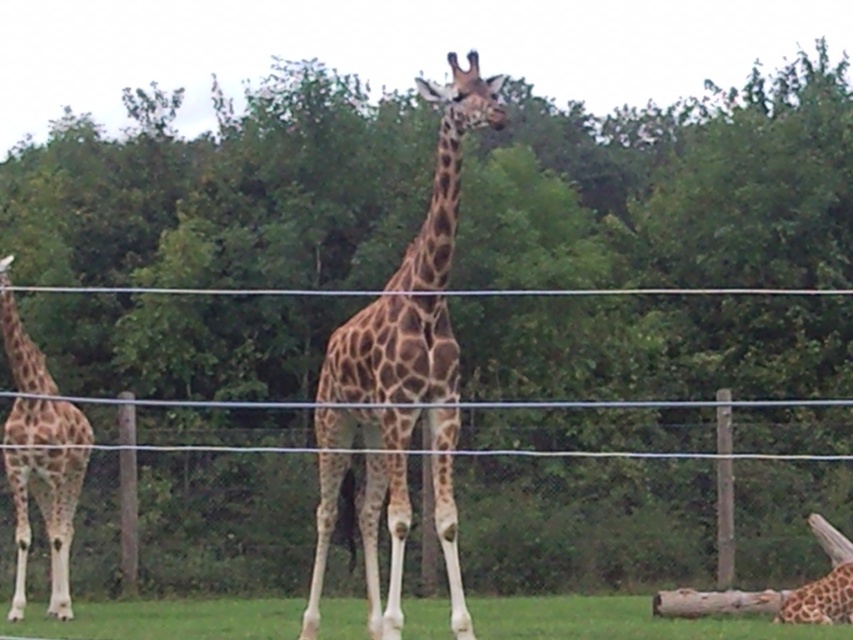
Question: Can you confirm if wire mesh fence at center is positioned above spotted fur giraffe at lower right?

Choices:
 (A) no
 (B) yes

Answer: (B)

Question: Which object is positioned closest to the spotted fur giraffe at left?

Choices:
 (A) wire mesh fence at center
 (B) spotted fur giraffe at lower right
 (C) spotted fur giraffe at center
 (D) green grass at lower center

Answer: (D)

Question: Which point is farther to the camera?

Choices:
 (A) (35, 572)
 (B) (202, 611)

Answer: (A)

Question: Does wire mesh fence at center have a lesser width compared to spotted fur giraffe at center?

Choices:
 (A) no
 (B) yes

Answer: (B)

Question: Which of the following is the closest to the observer?

Choices:
 (A) green grass at lower center
 (B) spotted fur giraffe at center
 (C) spotted fur giraffe at lower right
 (D) wire mesh fence at center

Answer: (B)

Question: Can you confirm if green grass at lower center is wider than spotted fur giraffe at lower right?

Choices:
 (A) no
 (B) yes

Answer: (B)